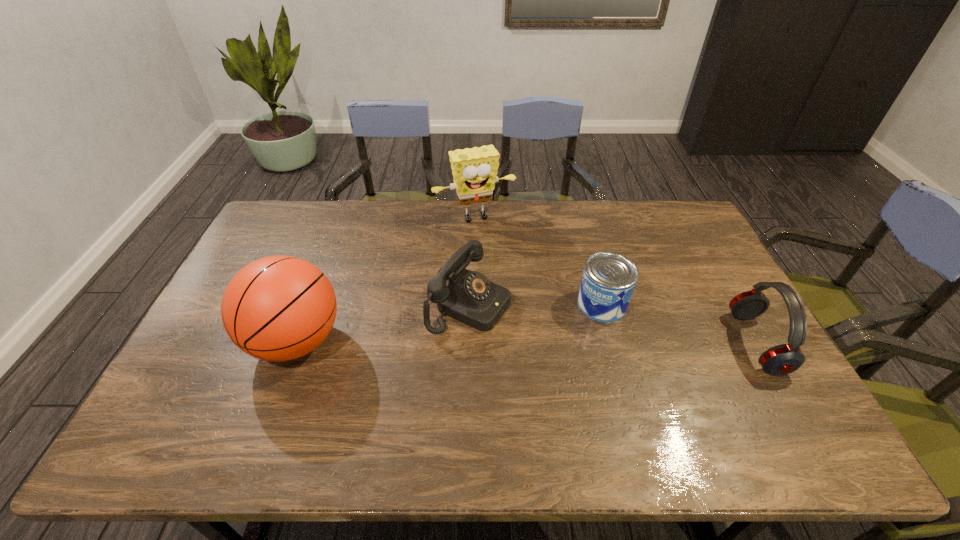
The height and width of the screenshot is (540, 960). I want to click on basketball that is at the near edge, so 278,308.

This screenshot has width=960, height=540. Find the location of `earphone at the near edge`. earphone at the near edge is located at coordinates (783, 359).

At what (x,y) coordinates should I click in order to perform the action: click on object that is at the left edge. Please return your answer as a coordinate pair (x, y). Looking at the image, I should click on (278, 308).

Locate an element on the screen. Image resolution: width=960 pixels, height=540 pixels. object that is at the right edge is located at coordinates (783, 359).

The width and height of the screenshot is (960, 540). I want to click on object that is at the near left corner, so click(278, 308).

Where is `object present at the near right corner`? The height and width of the screenshot is (540, 960). object present at the near right corner is located at coordinates point(783,359).

Find the location of a particular element. The width and height of the screenshot is (960, 540). vacant space at the far edge of the desktop is located at coordinates (529, 232).

In the image, there is a desktop. Find the location of `free region at the near edge`. free region at the near edge is located at coordinates (327, 381).

What are the coordinates of `free space at the right edge` in the screenshot? It's located at (700, 335).

This screenshot has height=540, width=960. What are the coordinates of `vacant space at the far right corner of the desktop` in the screenshot? It's located at (682, 202).